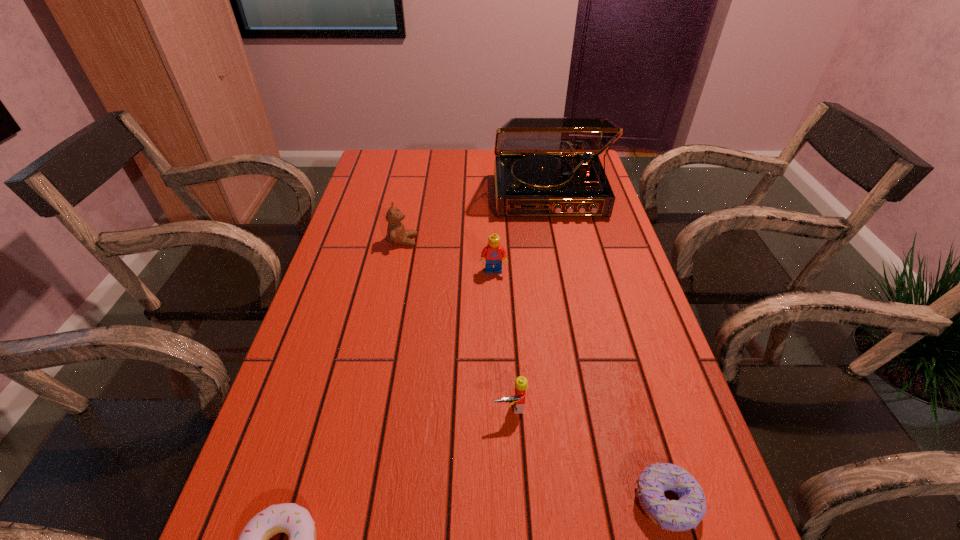
You are a GUI agent. You are given a task and a screenshot of the screen. Output one action in this format:
    pyautogui.click(x=<x>, y=<y>)
    Task: Click on the farthest object
    This screenshot has width=960, height=540.
    Given the screenshot: What is the action you would take?
    pyautogui.click(x=544, y=167)

What are the coordinates of `the tallest object` in the screenshot? It's located at (544, 167).

Where is `teddy bear`? Image resolution: width=960 pixels, height=540 pixels. teddy bear is located at coordinates 396,233.

At what (x,y) coordinates should I click in order to perform the action: click on the taller Lego. Please return your answer as a coordinate pair (x, y). The image size is (960, 540). Looking at the image, I should click on [493, 253].

Identify the location of the farther Lego. This screenshot has height=540, width=960. (493, 253).

Find the location of `the third nearest object`. the third nearest object is located at coordinates (521, 383).

The image size is (960, 540). I want to click on the nearer Lego, so click(521, 383).

Locate an element on the screen. The image size is (960, 540). the right doughnut is located at coordinates (686, 513).

This screenshot has height=540, width=960. Find the location of `free region located on the front-facing side of the record player`. free region located on the front-facing side of the record player is located at coordinates (574, 316).

I want to click on vacant space located 0.120m on the face of the fifth nearest object, so click(x=459, y=241).